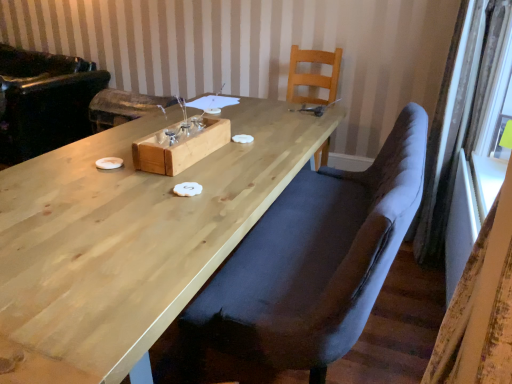
What do you see at coordinates (315, 260) in the screenshot?
I see `velvet dark blue chair at center, the 2th chair in the back-to-front sequence` at bounding box center [315, 260].

What is the approximate height of black leather armchair at left?

It is 34.88 inches.

This screenshot has width=512, height=384. What do you see at coordinates (179, 148) in the screenshot?
I see `natural wood tray at center` at bounding box center [179, 148].

At what (x,y) coordinates should I click in order to perform the action: click on natural wood table at center. Please return your answer as a coordinate pair (x, y). This screenshot has width=512, height=384. Looking at the image, I should click on (130, 238).

Does velvet dark blue chair at center, the 2th chair in the back-to-front sequence, lie in front of yellowish fabric curtain at right, the 2th curtain in the top-to-bottom sequence?

Yes, it is in front of yellowish fabric curtain at right, the 2th curtain in the top-to-bottom sequence.

From the image's perspective, is velvet dark blue chair at center, the 1th chair positioned from the front, positioned above or below yellowish fabric curtain at right, the 2th curtain in the top-to-bottom sequence?

Based on their image positions, velvet dark blue chair at center, the 1th chair positioned from the front, is located above yellowish fabric curtain at right, the 2th curtain in the top-to-bottom sequence.

Can you confirm if velvet dark blue chair at center, the 1th chair positioned from the front, is bigger than yellowish fabric curtain at right, the 2th curtain in the top-to-bottom sequence?

Indeed, velvet dark blue chair at center, the 1th chair positioned from the front, has a larger size compared to yellowish fabric curtain at right, the 2th curtain in the top-to-bottom sequence.

How different are the orientations of velvet dark blue chair at center, the 2th chair in the back-to-front sequence, and yellowish fabric curtain at right, the 1th curtain ordered from the bottom, in degrees?

There is a 0.915-degree angle between the facing directions of velvet dark blue chair at center, the 2th chair in the back-to-front sequence, and yellowish fabric curtain at right, the 1th curtain ordered from the bottom.

From a real-world perspective, does natural wood table at center stand above natural wood chair at upper center, which is the 2th chair in front-to-back order?

No, from a real-world perspective, natural wood table at center is not over natural wood chair at upper center, which is the 2th chair in front-to-back order

How different are the orientations of natural wood table at center and natural wood chair at upper center, the 1th chair positioned from the back, in degrees?

86 degrees.

Is natural wood chair at upper center, the 1th chair positioned from the back, at the back of natural wood table at center?

No, natural wood table at center's orientation is not away from natural wood chair at upper center, the 1th chair positioned from the back.

Is natural wood table at center spatially inside natural wood chair at upper center, which is the 2th chair in front-to-back order, or outside of it?

natural wood table at center lies outside natural wood chair at upper center, which is the 2th chair in front-to-back order.

Which is closer to the camera, (509,263) or (161,172)?

The point (509,263) is more forward.

Considering the positions of objects yellowish fabric curtain at right, the 1th curtain ordered from the bottom, and natural wood tray at center in the image provided, who is more to the right, yellowish fabric curtain at right, the 1th curtain ordered from the bottom, or natural wood tray at center?

From the viewer's perspective, yellowish fabric curtain at right, the 1th curtain ordered from the bottom, appears more on the right side.

Considering the sizes of objects yellowish fabric curtain at right, the 2th curtain in the top-to-bottom sequence, and natural wood tray at center in the image provided, who is thinner, yellowish fabric curtain at right, the 2th curtain in the top-to-bottom sequence, or natural wood tray at center?

yellowish fabric curtain at right, the 2th curtain in the top-to-bottom sequence.

Does yellowish fabric curtain at right, the 2th curtain in the top-to-bottom sequence, have a larger size compared to natural wood tray at center?

Indeed, yellowish fabric curtain at right, the 2th curtain in the top-to-bottom sequence, has a larger size compared to natural wood tray at center.

From a real-world perspective, is black leather armchair at left located beneath yellowish fabric curtain at right, the 2th curtain in the top-to-bottom sequence?

Answer: No, from a real-world perspective, black leather armchair at left is not under yellowish fabric curtain at right, the 2th curtain in the top-to-bottom sequence.

From the image's perspective, which is below, black leather armchair at left or yellowish fabric curtain at right, the 1th curtain ordered from the bottom?

yellowish fabric curtain at right, the 1th curtain ordered from the bottom, is shown below in the image.

What's the angular difference between black leather armchair at left and yellowish fabric curtain at right, the 1th curtain ordered from the bottom,'s facing directions?

They differ by 91 degrees in their facing directions.

Is black leather armchair at left oriented away from yellowish fabric curtain at right, the 2th curtain in the top-to-bottom sequence?

No.

Starting from the natural wood chair at upper center, the 1th chair positioned from the back, which curtain is the 2nd one in front? Please provide its 2D coordinates.

[(480, 307)]

Considering the points (462, 307) and (297, 75), which point is behind, point (462, 307) or point (297, 75)?

The point (297, 75) is more distant.

Can natural wood chair at upper center, which is the 2th chair in front-to-back order, be found inside yellowish fabric curtain at right, the 2th curtain in the top-to-bottom sequence?

No, yellowish fabric curtain at right, the 2th curtain in the top-to-bottom sequence, does not contain natural wood chair at upper center, which is the 2th chair in front-to-back order.

Is natural wood chair at upper center, which is the 2th chair in front-to-back order, oriented away from velvet dark blue chair at center, the 1th chair positioned from the front?

That's not correct — natural wood chair at upper center, which is the 2th chair in front-to-back order, is not looking away from velvet dark blue chair at center, the 1th chair positioned from the front.

The height and width of the screenshot is (384, 512). Identify the location of chair located above the velvet dark blue chair at center, the 2th chair in the back-to-front sequence (from a real-world perspective). (313, 75).

Would you say natural wood chair at upper center, which is the 2th chair in front-to-back order, contains velvet dark blue chair at center, the 2th chair in the back-to-front sequence?

No, natural wood chair at upper center, which is the 2th chair in front-to-back order, does not contain velvet dark blue chair at center, the 2th chair in the back-to-front sequence.

Which of these two, natural wood chair at upper center, the 1th chair positioned from the back, or velvet dark blue chair at center, the 1th chair positioned from the front, stands shorter?

Standing shorter between the two is natural wood chair at upper center, the 1th chair positioned from the back.

Is velvet dark blue chair at center, the 1th chair positioned from the front, touching natural wood chair at upper center, which is the 2th chair in front-to-back order?

velvet dark blue chair at center, the 1th chair positioned from the front, and natural wood chair at upper center, which is the 2th chair in front-to-back order, are clearly separated.

Looking at this image, is the depth of velvet dark blue chair at center, the 1th chair positioned from the front, less than that of natural wood chair at upper center, which is the 2th chair in front-to-back order?

Yes, velvet dark blue chair at center, the 1th chair positioned from the front, is in front of natural wood chair at upper center, which is the 2th chair in front-to-back order.

From the image's perspective, between velvet dark blue chair at center, the 2th chair in the back-to-front sequence, and natural wood chair at upper center, which is the 2th chair in front-to-back order, which one is located above?

From the image's view, natural wood chair at upper center, which is the 2th chair in front-to-back order, is above.

Considering the relative sizes of velvet dark blue chair at center, the 1th chair positioned from the front, and natural wood chair at upper center, which is the 2th chair in front-to-back order, in the image provided, is velvet dark blue chair at center, the 1th chair positioned from the front, bigger than natural wood chair at upper center, which is the 2th chair in front-to-back order,?

Indeed, velvet dark blue chair at center, the 1th chair positioned from the front, has a larger size compared to natural wood chair at upper center, which is the 2th chair in front-to-back order.

The image size is (512, 384). In order to click on chair in front of the yellowish fabric curtain at right, the 2th curtain in the top-to-bottom sequence in this screenshot , I will do `click(315, 260)`.

This screenshot has height=384, width=512. I want to click on table lying on the left of natural wood chair at upper center, which is the 2th chair in front-to-back order, so click(130, 238).

Looking at the image, which one is located further to velvet curtain at right, acting as the 2th curtain starting from the bottom, natural wood chair at upper center, the 1th chair positioned from the back, or velvet dark blue chair at center, the 1th chair positioned from the front?

The object further to velvet curtain at right, acting as the 2th curtain starting from the bottom, is natural wood chair at upper center, the 1th chair positioned from the back.

Based on their spatial positions, is natural wood tray at center or velvet dark blue chair at center, the 2th chair in the back-to-front sequence, further from velvet curtain at right, positioned as the 1th curtain in top-to-bottom order?

Among the two, natural wood tray at center is located further to velvet curtain at right, positioned as the 1th curtain in top-to-bottom order.

Estimate the real-world distances between objects in this image. Which object is closer to natural wood tray at center, black leather armchair at left or natural wood table at center?

Based on the image, natural wood table at center appears to be nearer to natural wood tray at center.

Which object lies nearer to the anchor point natural wood chair at upper center, which is the 2th chair in front-to-back order, velvet curtain at right, acting as the 2th curtain starting from the bottom, or natural wood table at center?

velvet curtain at right, acting as the 2th curtain starting from the bottom.

When comparing their distances from natural wood table at center, does natural wood chair at upper center, which is the 2th chair in front-to-back order, or natural wood tray at center seem closer?

Among the two, natural wood tray at center is located nearer to natural wood table at center.

From the image, which object appears to be farther from velvet dark blue chair at center, the 2th chair in the back-to-front sequence, black leather armchair at left or yellowish fabric curtain at right, the 1th curtain ordered from the bottom?

black leather armchair at left.

Estimate the real-world distances between objects in this image. Which object is closer to yellowish fabric curtain at right, the 1th curtain ordered from the bottom, natural wood chair at upper center, which is the 2th chair in front-to-back order, or velvet curtain at right, acting as the 2th curtain starting from the bottom?

velvet curtain at right, acting as the 2th curtain starting from the bottom, lies closer to yellowish fabric curtain at right, the 1th curtain ordered from the bottom, than the other object.

When comparing their distances from black leather armchair at left, does yellowish fabric curtain at right, the 2th curtain in the top-to-bottom sequence, or natural wood table at center seem closer?

natural wood table at center.

What are the coordinates of `chair between natural wood table at center and natural wood chair at upper center, the 1th chair positioned from the back, from front to back` in the screenshot? It's located at (315, 260).

The image size is (512, 384). Identify the location of wood between black leather armchair at left and yellowish fabric curtain at right, the 2th curtain in the top-to-bottom sequence, in the horizontal direction. (179, 148).

You are a GUI agent. You are given a task and a screenshot of the screen. Output one action in this format:
    pyautogui.click(x=<x>, y=<y>)
    Task: Click on the table located between black leather armchair at left and velvet curtain at right, positioned as the 1th curtain in top-to-bottom order, in the left-right direction
    The width and height of the screenshot is (512, 384).
    Given the screenshot: What is the action you would take?
    pyautogui.click(x=130, y=238)

Image resolution: width=512 pixels, height=384 pixels. Find the location of `table between black leather armchair at left and natural wood chair at upper center, which is the 2th chair in front-to-back order, from left to right`. table between black leather armchair at left and natural wood chair at upper center, which is the 2th chair in front-to-back order, from left to right is located at coordinates (130, 238).